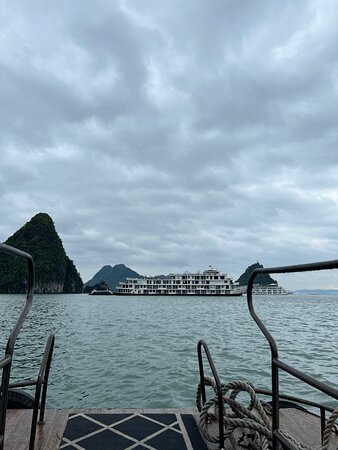
Find the location of a particular element. The width and height of the screenshot is (338, 450). window is located at coordinates (170, 290), (174, 290), (179, 286), (201, 286).